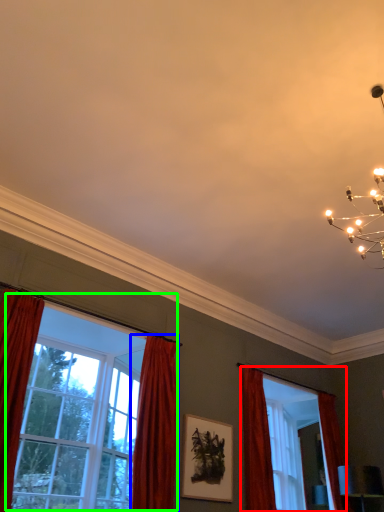
Question: Based on their relative distances, which object is farther from window (highlighted by a red box)? Choose from curtain (highlighted by a blue box) and window (highlighted by a green box).

Choices:
 (A) curtain
 (B) window

Answer: (B)